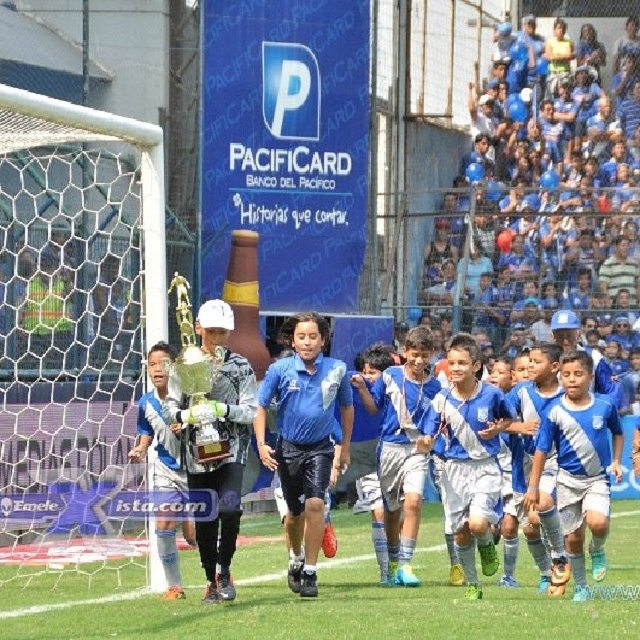
You are a photographer standing at the edge of the soccer field. You want to take a photo of both the blue shiny shorts at center and the blue jersey at center. Which object should you focus on first to ensure it appears sharp in the photo?

The blue shiny shorts at center is further to the viewer than the blue jersey at center, so you should focus on the blue shiny shorts at center first to ensure it appears sharp before the blue jersey at center.

Looking at this image, you are a photographer positioned at the edge of the soccer field. You want to take a photo that includes both the shiny silver trophy at center and the white matte soccer uniform at center. Given that your camera has a maximum focus range of 8 feet, will you be able to capture both subjects in focus without moving your position?

The shiny silver trophy at center and the white matte soccer uniform at center are 8.79 feet apart. Since the distance between them exceeds the camera maximum focus range of 8 feet, you cannot capture both subjects in focus without moving your position.

You are a photographer standing at the edge of the soccer field. You want to take a picture of the green grass at center and the blue jersey shorts at center. How far apart are these two elements in the scene?

The green grass at center is 8.97 meters away from the blue jersey shorts at center, so the distance between them is 8.97 meters.